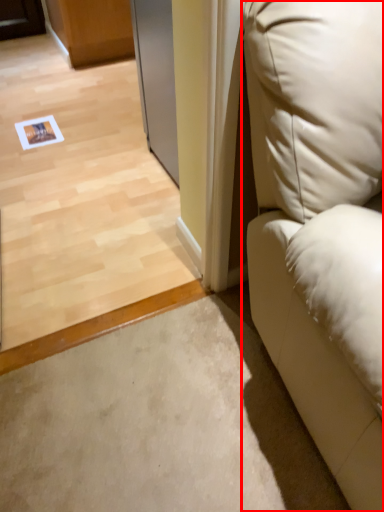
Question: From the image's perspective, where is furniture (annotated by the red box) located in relation to screen door in the image?

Choices:
 (A) below
 (B) above

Answer: (A)